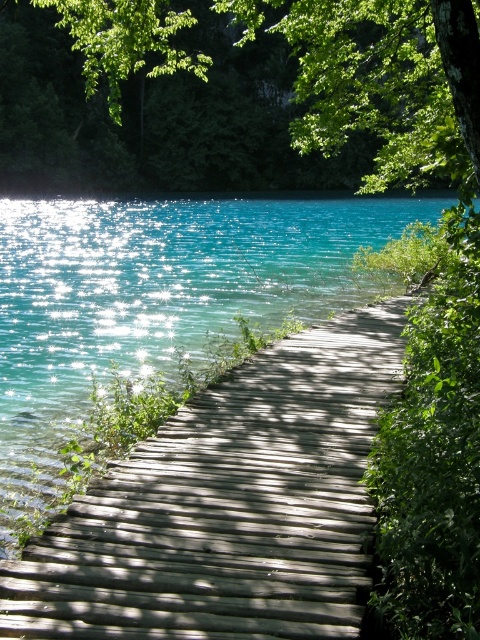
Looking at this image, you are standing on the wooden dock at center and looking towards the green leafy tree at upper center. Which object appears taller from your perspective?

The green leafy tree at upper center appears taller than the wooden dock at center because the wooden dock at center is shorter than green leafy tree at upper center.